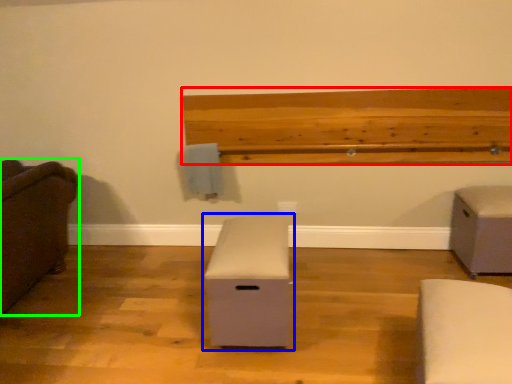
Question: Based on their relative distances, which object is nearer to ledge (highlighted by a red box)? Choose from furniture (highlighted by a blue box) and furniture (highlighted by a green box).

Choices:
 (A) furniture
 (B) furniture

Answer: (A)